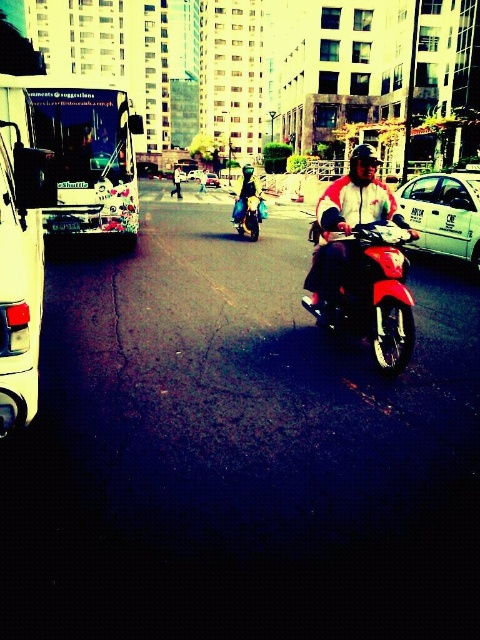
Question: Which object is closer to the camera taking this photo?

Choices:
 (A) white plastic license plate at center
 (B) white matte van at left

Answer: (B)

Question: Among these points, which one is farthest from the camera?

Choices:
 (A) (74, 227)
 (B) (233, 216)
 (C) (392, 291)
 (D) (35, 378)

Answer: (B)

Question: Which of the following is the farthest from the observer?

Choices:
 (A) (204, 173)
 (B) (350, 328)

Answer: (A)

Question: Is the position of white matte taxi at center less distant than that of white plastic license plate at center?

Choices:
 (A) yes
 (B) no

Answer: (A)

Question: Is the position of white matte taxi at center less distant than that of white cotton shirt at center?

Choices:
 (A) yes
 (B) no

Answer: (A)

Question: Can you confirm if white matte van at left is smaller than shiny blue motorcycle at center?

Choices:
 (A) yes
 (B) no

Answer: (B)